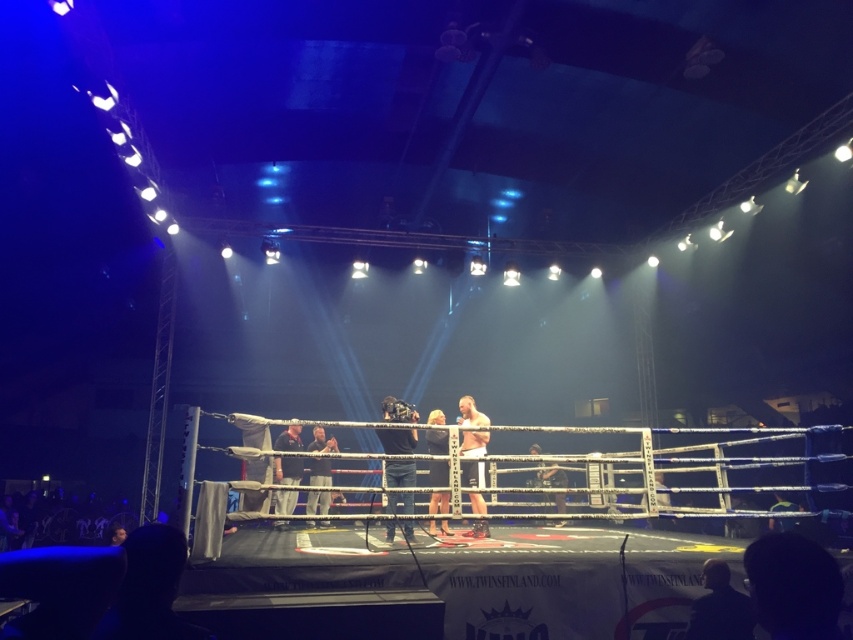
You are a photographer positioned at the edge of the boxing ring. You need to take a photo that includes both the smooth white shirt at center and the dark brown leather jacket at center. Given the distance between them, will you need to zoom in or zoom out to capture both subjects in the frame?

The smooth white shirt at center is 9.59 feet from the dark brown leather jacket at center. To capture both in the frame, you would need to zoom out to widen the field of view, as they are over 9 feet apart.

You are a photographer standing at the edge of the boxing ring. You want to take a photo of the smooth white shirt at center while also including the camera held by the person to the left. Given that the distance between them is 6.66 meters, can you fit both subjects in your frame if your camera has a maximum field of view of 6 meters?

The smooth white shirt at center and camera are 6.66 meters apart, which exceeds the camera field of view of 6 meters. Therefore, you cannot fit both subjects in the frame at the same time.